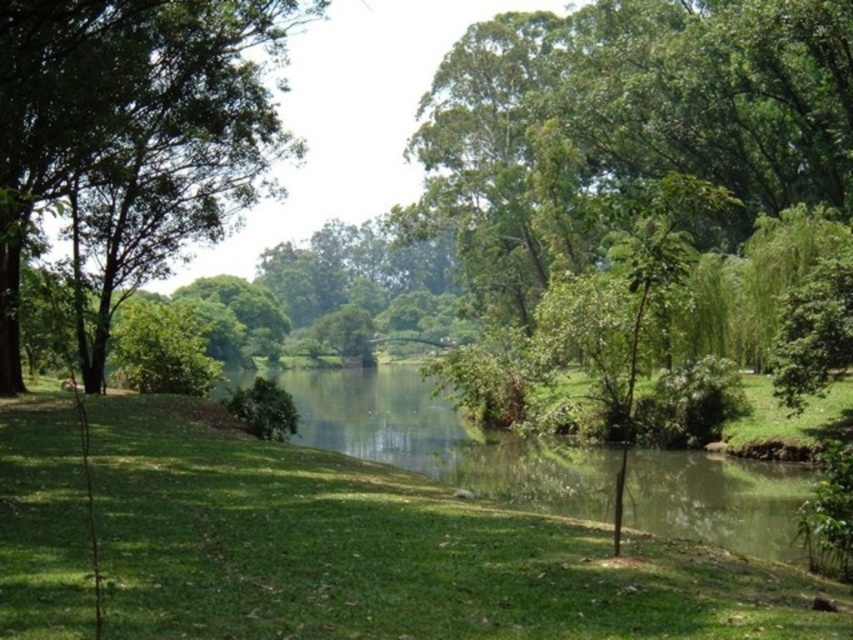
Question: Does green grassy at center have a larger size compared to green leafy tree at left?

Choices:
 (A) yes
 (B) no

Answer: (B)

Question: Among these objects, which one is farthest from the camera?

Choices:
 (A) green leafy tree at left
 (B) green grassy at center

Answer: (B)

Question: Which point is farther to the camera?

Choices:
 (A) (9, 209)
 (B) (538, 637)

Answer: (B)

Question: Is green grassy at center to the left of green leafy tree at left from the viewer's perspective?

Choices:
 (A) yes
 (B) no

Answer: (B)

Question: Does green grassy at center appear under green leafy tree at left?

Choices:
 (A) yes
 (B) no

Answer: (A)